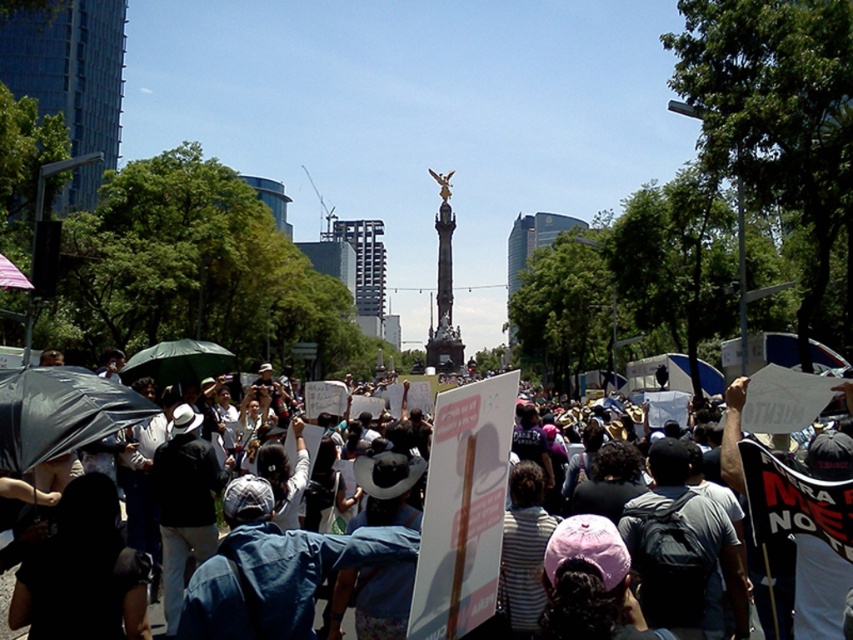
Question: Which is nearer to the denim jacket at center?

Choices:
 (A) denim jacket at lower left
 (B) matte black umbrella at left

Answer: (A)

Question: Is denim jacket at center closer to the viewer compared to denim jacket at lower left?

Choices:
 (A) no
 (B) yes

Answer: (B)

Question: Which is nearer to the denim jacket at center?

Choices:
 (A) denim jacket at lower left
 (B) matte black umbrella at left

Answer: (A)

Question: Is denim jacket at center smaller than green matte umbrella at center?

Choices:
 (A) yes
 (B) no

Answer: (B)

Question: Which of the following is the farthest from the observer?

Choices:
 (A) matte black umbrella at left
 (B) green matte umbrella at center
 (C) denim jacket at center
 (D) denim jacket at lower left

Answer: (B)

Question: Does denim jacket at center appear on the left side of matte black umbrella at left?

Choices:
 (A) no
 (B) yes

Answer: (A)